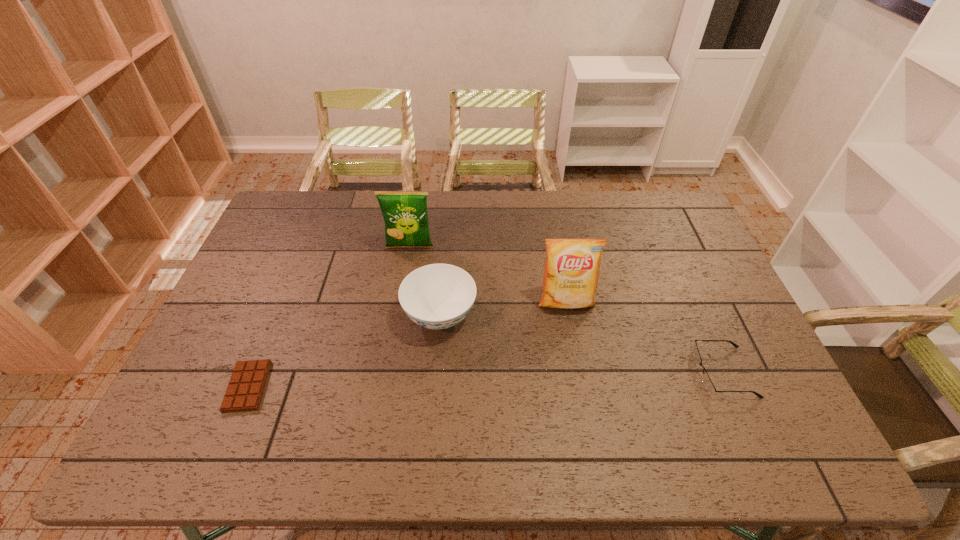
You are a GUI agent. You are given a task and a screenshot of the screen. Output one action in this format:
    pyautogui.click(x=<x>, y=<y>)
    Task: Click on the free space between the leftmost object and the farther crisp (potato chip)
    
    Given the screenshot: What is the action you would take?
    tap(328, 317)

Identify which object is the fourth nearest to the chinaware. Please provide its 2D coordinates. Your answer should be formatted as a tuple, i.e. [(x, y)], where the tuple contains the x and y coordinates of a point satisfying the conditions above.

[(707, 382)]

Locate an element on the screen. Image resolution: width=960 pixels, height=540 pixels. object that ranks as the third closest to the chinaware is located at coordinates (247, 383).

Where is `free location that satisfies the following two spatial constraints: 1. on the front-facing side of the chinaware; 2. on the right side of the left crisp (potato chip)`? The image size is (960, 540). free location that satisfies the following two spatial constraints: 1. on the front-facing side of the chinaware; 2. on the right side of the left crisp (potato chip) is located at coordinates (398, 316).

You are a GUI agent. You are given a task and a screenshot of the screen. Output one action in this format:
    pyautogui.click(x=<x>, y=<y>)
    Task: Click on the free space that satisfies the following two spatial constraints: 1. on the back side of the leftmost object; 2. on the left side of the third shortest object
    
    Given the screenshot: What is the action you would take?
    pyautogui.click(x=276, y=316)